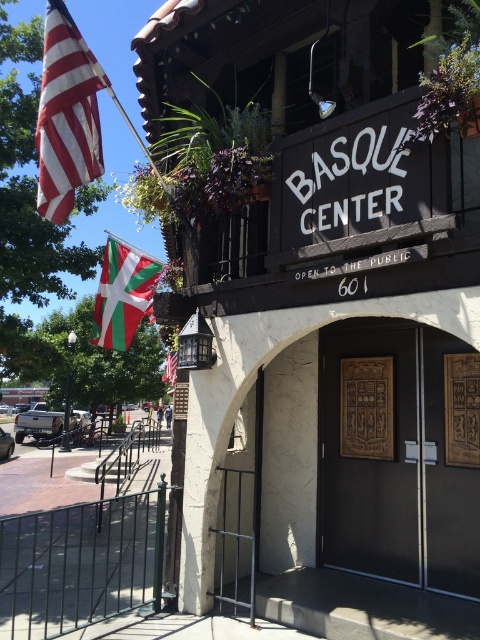
You are a visitor approaching the building and want to read the wooden sign at upper center and the wooden door at center. Which object is wider?

The wooden sign at upper center is wider than the wooden door at center.